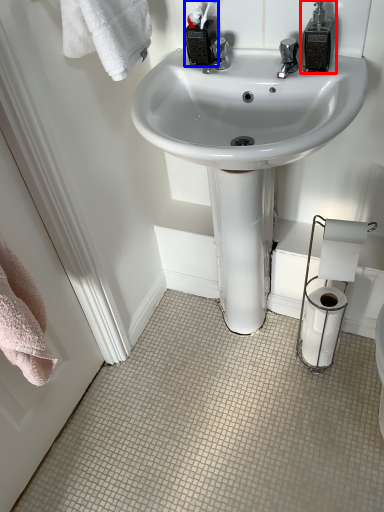
Question: Which of the following is the closest to the observer, soap dispenser (highlighted by a red box) or toiletry (highlighted by a blue box)?

Choices:
 (A) soap dispenser
 (B) toiletry

Answer: (A)